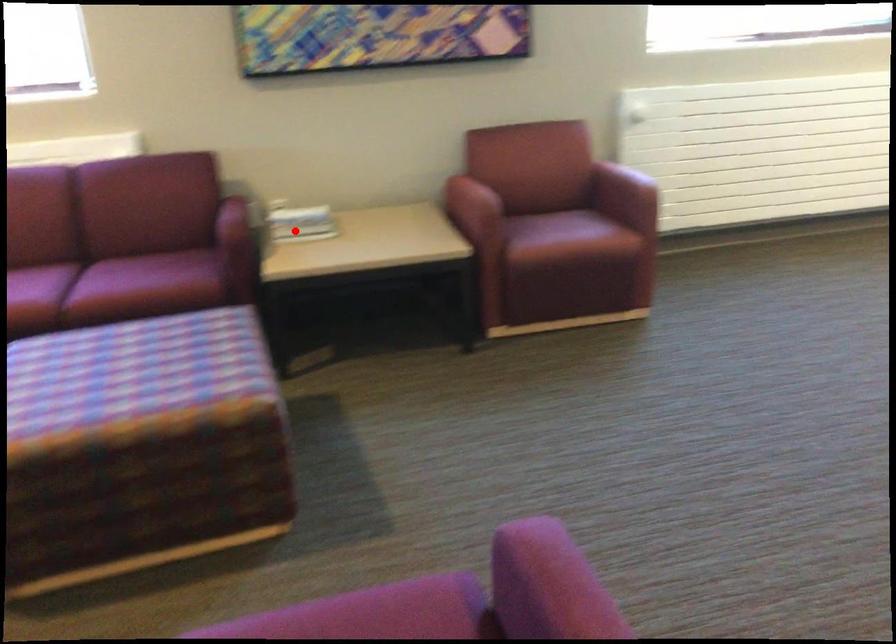
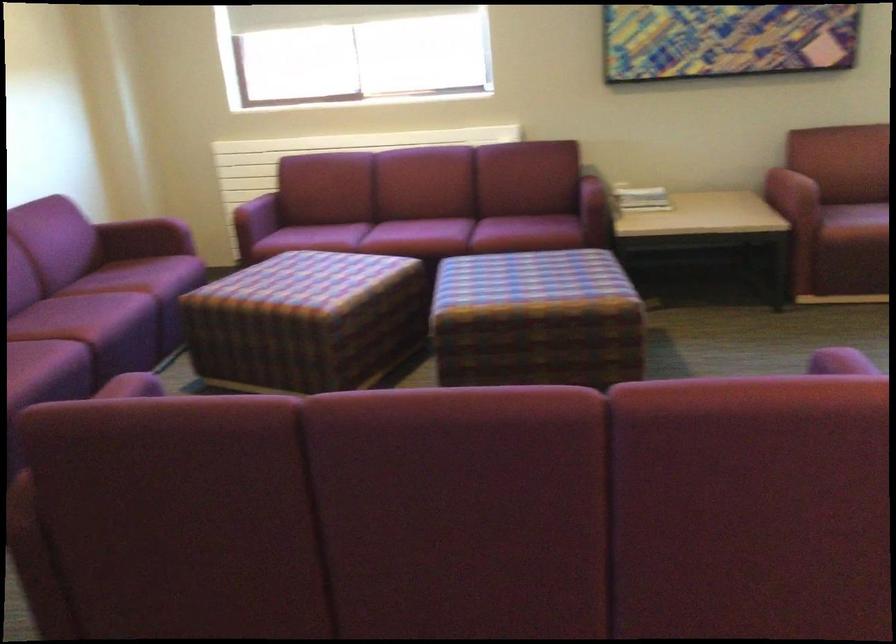
The point at the highlighted location is marked in the first image. Where is the corresponding point in the second image?

(640, 198)